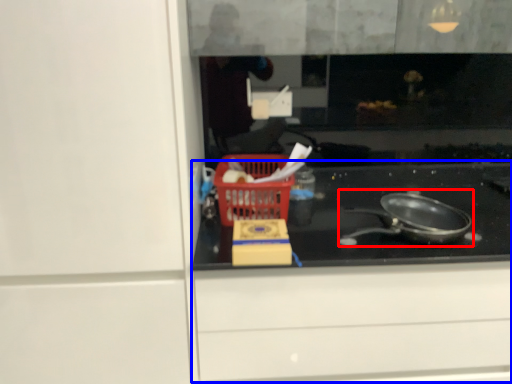
Question: Which point is closer to the camera, frying pan (highlighted by a red box) or cabinetry (highlighted by a blue box)?

Choices:
 (A) frying pan
 (B) cabinetry

Answer: (A)